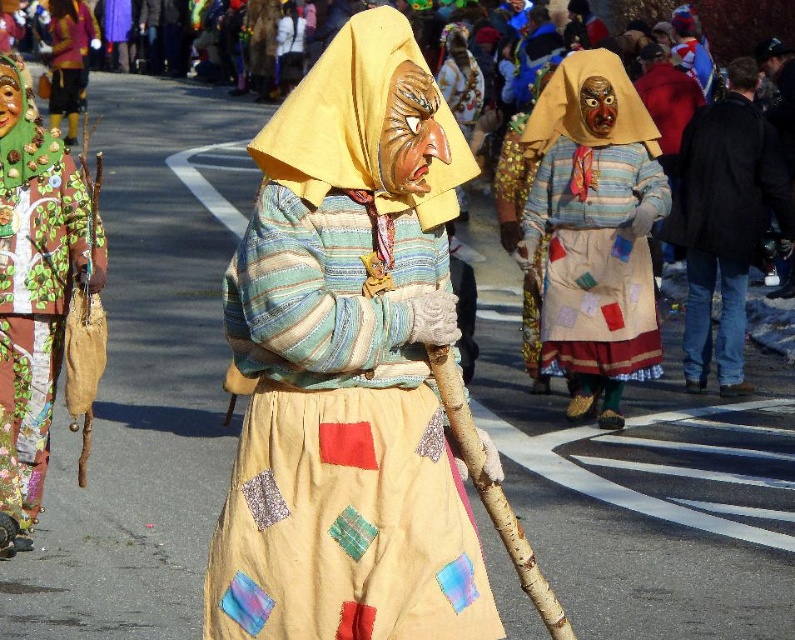
You are standing in the middle of the street and want to take a photo of the matte yellow fabric mask at center. Where should you position yourself to capture it in the frame?

Position yourself so the matte yellow fabric mask at center is centered at coordinates approximately 0.572 on the x axis and 0.439 on the y axis to capture it in the frame.